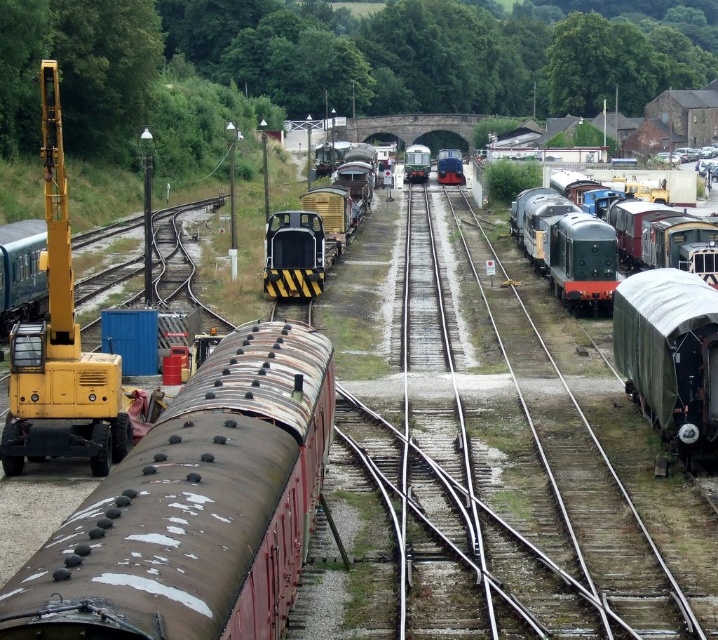
You are a railway worker who needs to move a cargo container that is 2 meters wide. You see the black textured locomotive at center and the polished dark blue locomotive at center. Which locomotive can accommodate the cargo container if the container must be placed between them without overlapping?

The black textured locomotive at center is wider than the polished dark blue locomotive at center, so the cargo container can fit between them if placed next to the black textured locomotive at center.

What are the coordinates of the green polished wood train at center?

The coordinates of the green polished wood train at center are at point (416, 163).

You are standing in the railway yard and want to walk from point (409, 148) to point (452, 150). Which direction should you move in to get closer to your destination?

You should move backward because point (409, 148) is closer to the viewer than point (452, 150). Moving backward will take you towards the latter point.